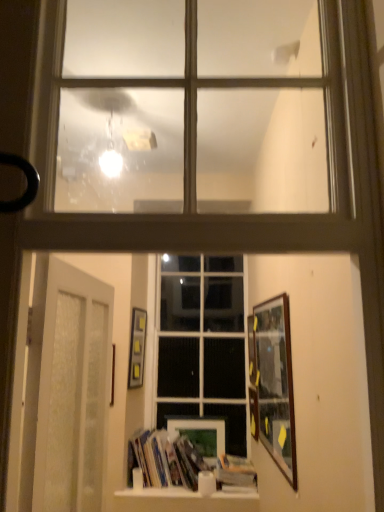
Describe the element at coordinates (72, 391) in the screenshot. I see `white frosted glass door at lower left` at that location.

Describe the element at coordinates (252, 350) in the screenshot. This screenshot has height=512, width=384. I see `wooden picture frame at center, the 1th picture frame from the right` at that location.

This screenshot has width=384, height=512. What do you see at coordinates (182, 462) in the screenshot? I see `hardcover books at center` at bounding box center [182, 462].

The width and height of the screenshot is (384, 512). Find the location of `hardcover book at center`. hardcover book at center is located at coordinates (235, 472).

Find the location of a particular element. wooden picture frame at center, marked as the second picture frame in a right-to-left arrangement is located at coordinates (254, 413).

Describe the element at coordinates (201, 435) in the screenshot. This screenshot has height=512, width=384. I see `wooden picture frame at center, the 2th picture frame in the left-to-right sequence` at that location.

Where is `white frosted glass door at lower left`? The width and height of the screenshot is (384, 512). white frosted glass door at lower left is located at coordinates (72, 391).

Considering the relative sizes of wooden picture frame at center, marked as the 4th picture frame in a right-to-left arrangement, and clear glass window at upper center, the 1th window positioned from the front, in the image provided, is wooden picture frame at center, marked as the 4th picture frame in a right-to-left arrangement, shorter than clear glass window at upper center, the 1th window positioned from the front,?

Answer: Yes, wooden picture frame at center, marked as the 4th picture frame in a right-to-left arrangement, is shorter than clear glass window at upper center, the 1th window positioned from the front.

The height and width of the screenshot is (512, 384). Find the location of `the 2nd window directly above the wooden picture frame at center, marked as the 4th picture frame in a right-to-left arrangement (from a real-world perspective)`. the 2nd window directly above the wooden picture frame at center, marked as the 4th picture frame in a right-to-left arrangement (from a real-world perspective) is located at coordinates (198, 108).

Is point (198, 449) closer or farther from the camera than point (228, 96)?

Point (198, 449).

In the scene shown: From the image's perspective, which is above, wooden picture frame at center, marked as the 4th picture frame in a right-to-left arrangement, or clear glass window at upper center, which appears as the 1th window when viewed from the top?

clear glass window at upper center, which appears as the 1th window when viewed from the top, is shown above in the image.

Can you see hardcover books at center touching white frosted glass door at lower left?

No, hardcover books at center is not making contact with white frosted glass door at lower left.

Which is more to the right, hardcover books at center or white frosted glass door at lower left?

hardcover books at center.

Would you say hardcover books at center contains white frosted glass door at lower left?

No, white frosted glass door at lower left is not surrounded by hardcover books at center.

Considering the relative sizes of wooden picture frame at right, marked as the 3th picture frame in a left-to-right arrangement, and wooden picture frame at center, the 2th picture frame in the left-to-right sequence, in the image provided, is wooden picture frame at right, marked as the 3th picture frame in a left-to-right arrangement, bigger than wooden picture frame at center, the 2th picture frame in the left-to-right sequence,?

Indeed, wooden picture frame at right, marked as the 3th picture frame in a left-to-right arrangement, has a larger size compared to wooden picture frame at center, the 2th picture frame in the left-to-right sequence.

Is wooden picture frame at right, marked as the 3th picture frame in a left-to-right arrangement, to the right of wooden picture frame at center, the 2th picture frame in the left-to-right sequence, from the viewer's perspective?

Yes, wooden picture frame at right, marked as the 3th picture frame in a left-to-right arrangement, is to the right of wooden picture frame at center, the 2th picture frame in the left-to-right sequence.

Which is in front, wooden picture frame at right, marked as the 3th picture frame in a left-to-right arrangement, or wooden picture frame at center, the 2th picture frame in the left-to-right sequence?

wooden picture frame at right, marked as the 3th picture frame in a left-to-right arrangement, is closer to the camera.

Could you measure the distance between matte black picture frame at center-left, the first picture frame positioned from the left, and white frosted glass door at lower left?

matte black picture frame at center-left, the first picture frame positioned from the left, is 4.49 feet from white frosted glass door at lower left.

What's the angular difference between matte black picture frame at center-left, the first picture frame positioned from the left, and white frosted glass door at lower left's facing directions?

The angle between the facing direction of matte black picture frame at center-left, the first picture frame positioned from the left, and the facing direction of white frosted glass door at lower left is 11.9 degrees.

Consider the image. Considering the relative sizes of matte black picture frame at center-left, the first picture frame positioned from the left, and white frosted glass door at lower left in the image provided, is matte black picture frame at center-left, the first picture frame positioned from the left, bigger than white frosted glass door at lower left?

Incorrect, matte black picture frame at center-left, the first picture frame positioned from the left, is not larger than white frosted glass door at lower left.

Is matte black picture frame at center-left, the 5th picture frame from the right, not within white frosted glass door at lower left?

Yes, matte black picture frame at center-left, the 5th picture frame from the right, is located beyond the bounds of white frosted glass door at lower left.

Is wooden picture frame at right, which appears as the 3th picture frame when viewed from the right, positioned with its back to hardcover book at center?

No, wooden picture frame at right, which appears as the 3th picture frame when viewed from the right,'s orientation is not away from hardcover book at center.

Is wooden picture frame at right, marked as the 3th picture frame in a left-to-right arrangement, inside the boundaries of hardcover book at center, or outside?

wooden picture frame at right, marked as the 3th picture frame in a left-to-right arrangement, is outside hardcover book at center.

I want to click on paperback book below the wooden picture frame at right, marked as the 3th picture frame in a left-to-right arrangement (from a real-world perspective), so click(x=235, y=472).

From the image's perspective, is wooden picture frame at right, which appears as the 3th picture frame when viewed from the right, positioned above or below hardcover book at center?

Clearly, from the image's perspective, wooden picture frame at right, which appears as the 3th picture frame when viewed from the right, is above hardcover book at center.

Consider the image. Is hardcover book at center surrounded by white frosted glass door at lower left?

That's incorrect, hardcover book at center is not inside white frosted glass door at lower left.

Is white frosted glass door at lower left aimed at hardcover book at center?

No, white frosted glass door at lower left is not oriented towards hardcover book at center.

Looking at their sizes, would you say white frosted glass door at lower left is wider or thinner than hardcover book at center?

Considering their sizes, white frosted glass door at lower left looks slimmer than hardcover book at center.

From a real-world perspective, which is physically below, white frosted glass door at lower left or hardcover book at center?

hardcover book at center is physically lower.

Looking at this image, can you confirm if matte black picture frame at center-left, the first picture frame positioned from the left, is wider than hardcover book at center?

No, matte black picture frame at center-left, the first picture frame positioned from the left, is not wider than hardcover book at center.

From a real-world perspective, is matte black picture frame at center-left, the 5th picture frame from the right, beneath hardcover book at center?

No, from a real-world perspective, matte black picture frame at center-left, the 5th picture frame from the right, is not beneath hardcover book at center.

How many degrees apart are the facing directions of matte black picture frame at center-left, the 5th picture frame from the right, and hardcover book at center?

76.3 degrees separate the facing orientations of matte black picture frame at center-left, the 5th picture frame from the right, and hardcover book at center.

Does point (139, 330) lie in front of point (246, 486)?

No, it is not.

From the image's perspective, count 5th picture frames downward from the clear glass window at upper center, which appears as the 1th window when viewed from the top, and point to it. Please provide its 2D coordinates.

[(201, 435)]

The image size is (384, 512). Identify the location of door to the left of hardcover books at center. (72, 391).

Looking at the image, which one is located closer to clear glass window at upper center, the 1th window positioned from the front, wooden picture frame at center, the 1th picture frame from the right, or matte black picture frame at center-left, the first picture frame positioned from the left?

Among the two, matte black picture frame at center-left, the first picture frame positioned from the left, is located nearer to clear glass window at upper center, the 1th window positioned from the front.

Estimate the real-world distances between objects in this image. Which object is further from clear glass window at upper center, the 2th window from the back, wooden picture frame at center, marked as the 4th picture frame in a right-to-left arrangement, or matte black picture frame at center-left, the first picture frame positioned from the left?

wooden picture frame at center, marked as the 4th picture frame in a right-to-left arrangement.

Estimate the real-world distances between objects in this image. Which object is closer to white frosted glass door at lower left, black rubber door handle at left or hardcover book at center?

The object closer to white frosted glass door at lower left is black rubber door handle at left.

From the image, which object appears to be farther from hardcover book at center, clear glass window at center, the second window in the top-to-bottom sequence, or hardcover books at center?

clear glass window at center, the second window in the top-to-bottom sequence, is further to hardcover book at center.

From the image, which object appears to be nearer to clear glass window at upper center, which appears as the 1th window when viewed from the top, white frosted glass door at lower left or black rubber door handle at left?

white frosted glass door at lower left.

From the image, which object appears to be farther from wooden picture frame at center, which ranks as the 4th picture frame in left-to-right order, wooden picture frame at right, which appears as the 3th picture frame when viewed from the right, or hardcover books at center?

hardcover books at center is positioned further to the anchor wooden picture frame at center, which ranks as the 4th picture frame in left-to-right order.

Looking at the image, which one is located further to clear glass window at center, which is the 2th window in front-to-back order, white frosted glass door at lower left or wooden picture frame at center, which ranks as the 4th picture frame in left-to-right order?

The object further to clear glass window at center, which is the 2th window in front-to-back order, is white frosted glass door at lower left.

From the picture: From the image, which object appears to be nearer to black rubber door handle at left, clear glass window at upper center, the 1th window positioned from the front, or wooden picture frame at center, which ranks as the 4th picture frame in left-to-right order?

Based on the image, clear glass window at upper center, the 1th window positioned from the front, appears to be nearer to black rubber door handle at left.

This screenshot has height=512, width=384. I want to click on book positioned between white frosted glass door at lower left and matte black picture frame at center-left, the 5th picture frame from the right, from near to far, so point(182,462).

This screenshot has width=384, height=512. Find the location of `door between black rubber door handle at left and wooden picture frame at center, the 2th picture frame in the left-to-right sequence, from front to back`. door between black rubber door handle at left and wooden picture frame at center, the 2th picture frame in the left-to-right sequence, from front to back is located at coordinates (72, 391).

At what (x,y) coordinates should I click in order to perform the action: click on paperback book between wooden picture frame at right, marked as the 3th picture frame in a left-to-right arrangement, and wooden picture frame at center, marked as the 4th picture frame in a right-to-left arrangement, along the z-axis. Please return your answer as a coordinate pair (x, y). The width and height of the screenshot is (384, 512). Looking at the image, I should click on (235, 472).

Where is `paperback book located between black rubber door handle at left and clear glass window at center, which is the 2th window in front-to-back order, in the depth direction`? The image size is (384, 512). paperback book located between black rubber door handle at left and clear glass window at center, which is the 2th window in front-to-back order, in the depth direction is located at coordinates coord(235,472).